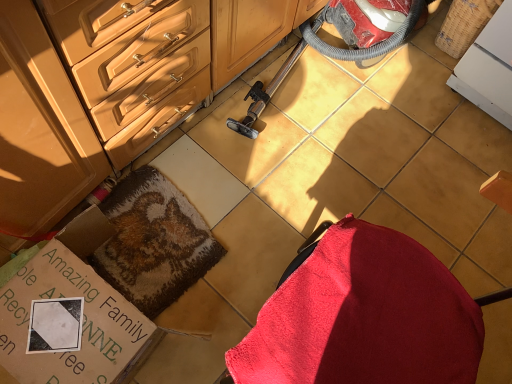
Locate an element on the screen. matte wood cabinetry at center is located at coordinates (42, 129).

This screenshot has width=512, height=384. Describe the element at coordinates (324, 54) in the screenshot. I see `red plastic vacuum cleaner at center` at that location.

What is the approximate width of fluffy brown rug at center?

fluffy brown rug at center is 17.07 inches wide.

The height and width of the screenshot is (384, 512). Describe the element at coordinates (153, 242) in the screenshot. I see `fluffy brown rug at center` at that location.

This screenshot has width=512, height=384. In order to click on matte wood cabinetry at center in this screenshot , I will do `click(42, 129)`.

Looking at the image, does matte wood cabinetry at center seem bigger or smaller compared to fluffy brown rug at center?

Clearly, matte wood cabinetry at center is larger in size than fluffy brown rug at center.

Where is `cabinetry on the right of the fluffy brown rug at center`? The width and height of the screenshot is (512, 384). cabinetry on the right of the fluffy brown rug at center is located at coordinates (42, 129).

In the scene shown: Which is nearer, (x=39, y=217) or (x=121, y=244)?

Point (x=39, y=217) is closer to the camera than point (x=121, y=244).

Is matte wood cabinetry at center not within fluffy brown rug at center?

Yes, matte wood cabinetry at center is not within fluffy brown rug at center.

From the image's perspective, is cardboard box at lower left positioned above or below fluffy brown rug at center?

cardboard box at lower left is situated lower than fluffy brown rug at center in the image.

Is cardboard box at lower left in contact with fluffy brown rug at center?

There is a gap between cardboard box at lower left and fluffy brown rug at center.

Can you confirm if cardboard box at lower left is smaller than fluffy brown rug at center?

No, cardboard box at lower left is not smaller than fluffy brown rug at center.

I want to click on blanket on the right of cardboard box at lower left, so click(153, 242).

Can you see fluffy brown rug at center touching red plastic vacuum cleaner at center?

No, fluffy brown rug at center is not touching red plastic vacuum cleaner at center.

From the image's perspective, which one is positioned higher, fluffy brown rug at center or red plastic vacuum cleaner at center?

From the image's view, red plastic vacuum cleaner at center is above.

In terms of width, does fluffy brown rug at center look wider or thinner when compared to red plastic vacuum cleaner at center?

Clearly, fluffy brown rug at center has less width compared to red plastic vacuum cleaner at center.

From a real-world perspective, who is located higher, fluffy brown rug at center or red plastic vacuum cleaner at center?

red plastic vacuum cleaner at center.

Is matte wood cabinetry at center oriented away from red plastic vacuum cleaner at center?

No, red plastic vacuum cleaner at center is not at the back of matte wood cabinetry at center.

Identify the location of cabinetry positioned vertically above the red plastic vacuum cleaner at center (from a real-world perspective). This screenshot has width=512, height=384. point(42,129).

Are matte wood cabinetry at center and red plastic vacuum cleaner at center beside each other?

No, matte wood cabinetry at center is not in contact with red plastic vacuum cleaner at center.

Does matte wood cabinetry at center have a greater width compared to red plastic vacuum cleaner at center?

No, matte wood cabinetry at center is not wider than red plastic vacuum cleaner at center.

Could velvet red swivel chair at center be considered to be inside fluffy brown rug at center?

No, velvet red swivel chair at center is not surrounded by fluffy brown rug at center.

From a real-world perspective, is fluffy brown rug at center above or below velvet red swivel chair at center?

Clearly, from a real-world perspective, fluffy brown rug at center is below velvet red swivel chair at center.

Is fluffy brown rug at center shorter than velvet red swivel chair at center?

Yes, fluffy brown rug at center is shorter than velvet red swivel chair at center.

Looking at this image, is fluffy brown rug at center closer to camera compared to velvet red swivel chair at center?

No, it is behind velvet red swivel chair at center.

From the image's perspective, is red plastic vacuum cleaner at center on top of matte wood cabinetry at center?

Yes, from the image's perspective, red plastic vacuum cleaner at center is above matte wood cabinetry at center.

This screenshot has width=512, height=384. Find the location of `cabinetry located on the left of red plastic vacuum cleaner at center`. cabinetry located on the left of red plastic vacuum cleaner at center is located at coordinates (42, 129).

Which point is more forward, [345,25] or [170,117]?

The point [170,117] is closer to the camera.

Is matte wood cabinetry at center completely or partially inside red plastic vacuum cleaner at center?

No, matte wood cabinetry at center is not a part of red plastic vacuum cleaner at center.

What's the angular difference between red plastic vacuum cleaner at center and cardboard box at lower left's facing directions?

They differ by 177 degrees in their facing directions.

Are red plastic vacuum cleaner at center and cardboard box at lower left making contact?

red plastic vacuum cleaner at center is not next to cardboard box at lower left, and they're not touching.

In the scene shown: From a real-world perspective, between red plastic vacuum cleaner at center and cardboard box at lower left, who is vertically higher?

red plastic vacuum cleaner at center.

Is red plastic vacuum cleaner at center taller or shorter than cardboard box at lower left?

Clearly, red plastic vacuum cleaner at center is taller compared to cardboard box at lower left.

Locate an element on the screen. The height and width of the screenshot is (384, 512). cabinetry on the right of fluffy brown rug at center is located at coordinates (42, 129).

Where is `blanket behind the cardboard box at lower left`? The height and width of the screenshot is (384, 512). blanket behind the cardboard box at lower left is located at coordinates (153, 242).

Considering their positions, is fluffy brown rug at center positioned closer to velvet red swivel chair at center than matte wood cabinetry at center?

Based on the image, fluffy brown rug at center appears to be nearer to velvet red swivel chair at center.

Looking at the image, which one is located closer to velvet red swivel chair at center, fluffy brown rug at center or red plastic vacuum cleaner at center?

The object closer to velvet red swivel chair at center is fluffy brown rug at center.

When comparing their distances from velvet red swivel chair at center, does matte wood cabinetry at center or red plastic vacuum cleaner at center seem further?

red plastic vacuum cleaner at center.

When comparing their distances from velvet red swivel chair at center, does cardboard box at lower left or fluffy brown rug at center seem closer?

cardboard box at lower left lies closer to velvet red swivel chair at center than the other object.

From the image, which object appears to be farther from cardboard box at lower left, velvet red swivel chair at center or matte wood cabinetry at center?

Among the two, velvet red swivel chair at center is located further to cardboard box at lower left.

Which object lies further to the anchor point velvet red swivel chair at center, fluffy brown rug at center or cardboard box at lower left?

Based on the image, fluffy brown rug at center appears to be further to velvet red swivel chair at center.

In the scene shown: Estimate the real-world distances between objects in this image. Which object is further from fluffy brown rug at center, velvet red swivel chair at center or red plastic vacuum cleaner at center?

Among the two, velvet red swivel chair at center is located further to fluffy brown rug at center.

Which object lies nearer to the anchor point fluffy brown rug at center, red plastic vacuum cleaner at center or matte wood cabinetry at center?

The object closer to fluffy brown rug at center is matte wood cabinetry at center.

The width and height of the screenshot is (512, 384). I want to click on swivel chair that lies between matte wood cabinetry at center and cardboard box at lower left from top to bottom, so click(x=362, y=316).

The height and width of the screenshot is (384, 512). I want to click on cardboard box between velvet red swivel chair at center and fluffy brown rug at center in the front-back direction, so click(68, 323).

Identify the location of cabinetry that lies between red plastic vacuum cleaner at center and cardboard box at lower left from top to bottom. The width and height of the screenshot is (512, 384). (42, 129).

This screenshot has width=512, height=384. Find the location of `cabinetry positioned between velvet red swivel chair at center and fluffy brown rug at center from near to far`. cabinetry positioned between velvet red swivel chair at center and fluffy brown rug at center from near to far is located at coordinates (42, 129).